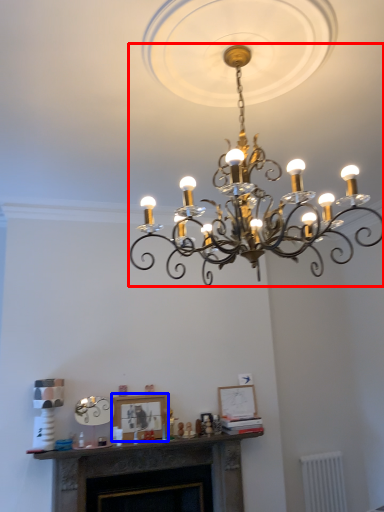
Question: Which object appears farthest to the camera in this image, lamp (highlighted by a red box) or picture frame (highlighted by a blue box)?

Choices:
 (A) lamp
 (B) picture frame

Answer: (B)